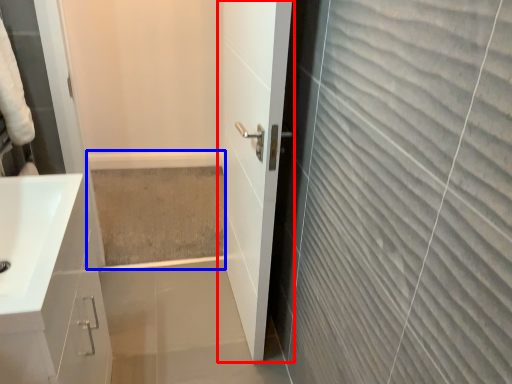
Question: Which point is further to the camera, door (highlighted by a red box) or bath (highlighted by a blue box)?

Choices:
 (A) door
 (B) bath

Answer: (B)